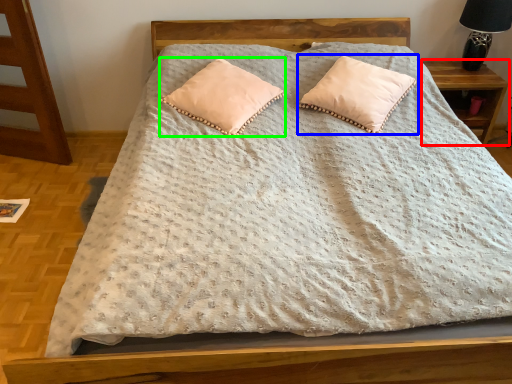
Question: Considering the real-world distances, which object is closest to nightstand (highlighted by a red box)? pillow (highlighted by a blue box) or pillow (highlighted by a green box).

Choices:
 (A) pillow
 (B) pillow

Answer: (A)